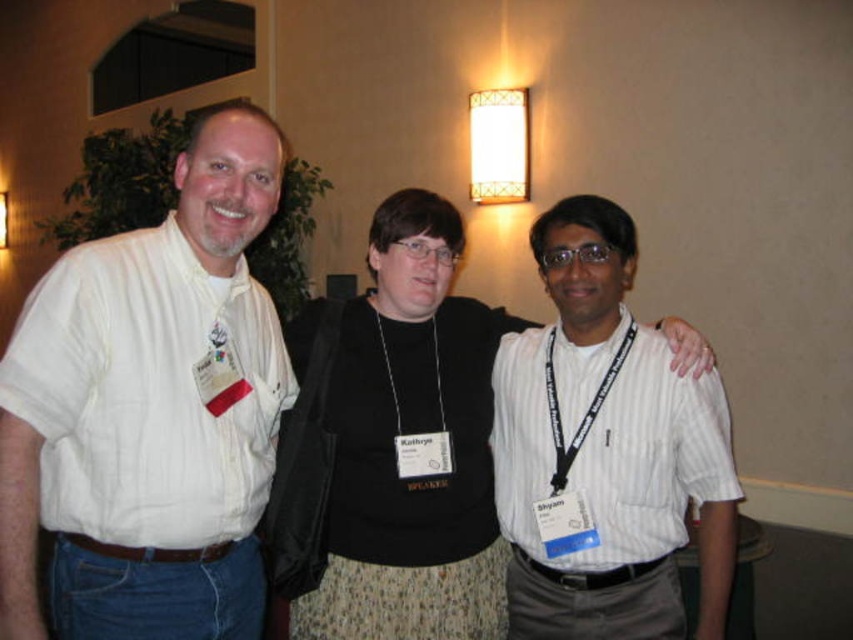
Consider the image. Is white striped shirt at left shorter than white striped shirt at center?

No, white striped shirt at left is not shorter than white striped shirt at center.

Who is more distant from viewer, (236, 157) or (734, 504)?

Point (734, 504)

Find the location of a particular element. This screenshot has width=853, height=640. white striped shirt at left is located at coordinates (148, 410).

Who is more distant from viewer, (199,298) or (466,401)?

The point (466,401) is behind.

Can you confirm if white striped shirt at left is positioned to the right of black fabric at center?

Incorrect, white striped shirt at left is not on the right side of black fabric at center.

Image resolution: width=853 pixels, height=640 pixels. What are the coordinates of `white striped shirt at left` in the screenshot? It's located at (148, 410).

Can you confirm if black fabric at center is taller than white striped shirt at center?

Correct, black fabric at center is much taller as white striped shirt at center.

This screenshot has height=640, width=853. Describe the element at coordinates (392, 448) in the screenshot. I see `black fabric at center` at that location.

The width and height of the screenshot is (853, 640). What are the coordinates of `black fabric at center` in the screenshot? It's located at (392, 448).